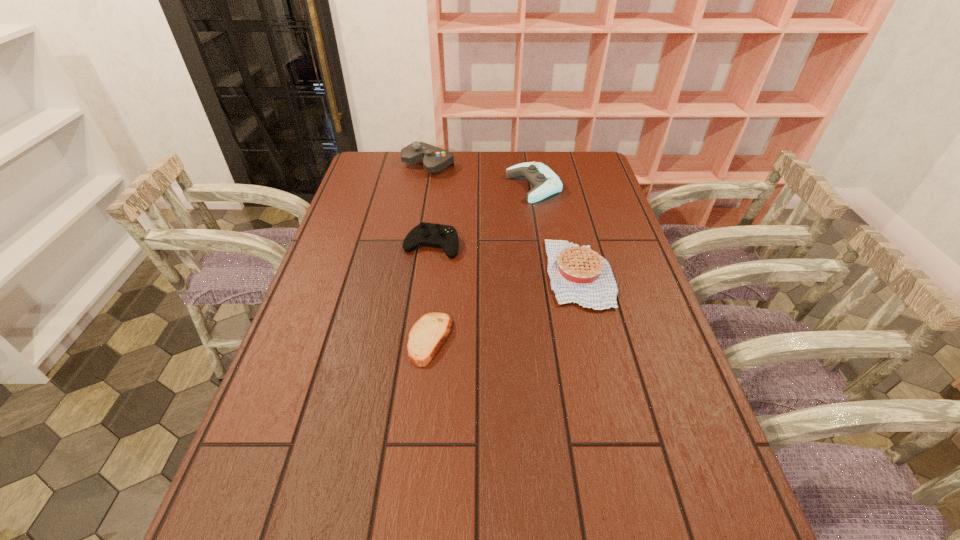
Find the location of a particular element. This screenshot has width=960, height=540. the tallest object is located at coordinates (434, 159).

The image size is (960, 540). I want to click on the rightmost control, so click(x=545, y=181).

In order to click on the nearest control in this screenshot , I will do `click(425, 234)`.

You are a GUI agent. You are given a task and a screenshot of the screen. Output one action in this format:
    pyautogui.click(x=<x>, y=<y>)
    Task: Click on the pie
    
    Given the screenshot: What is the action you would take?
    pyautogui.click(x=580, y=275)

You are a GUI agent. You are given a task and a screenshot of the screen. Output one action in this format:
    pyautogui.click(x=<x>, y=<y>)
    Task: Click on the nearest object
    The image size is (960, 540).
    Given the screenshot: What is the action you would take?
    pyautogui.click(x=427, y=335)

Where is `pita bread`? pita bread is located at coordinates (427, 335).

Locate an element on the screen. This screenshot has height=540, width=960. free space located on the front of the tallest object is located at coordinates (423, 191).

Locate an element on the screen. The height and width of the screenshot is (540, 960). vacant space located 0.110m on the left of the rightmost control is located at coordinates (476, 187).

The width and height of the screenshot is (960, 540). What are the coordinates of `free space located on the front of the nearest control` in the screenshot? It's located at (416, 374).

Locate an element on the screen. The width and height of the screenshot is (960, 540). vacant space located on the right of the pie is located at coordinates (630, 274).